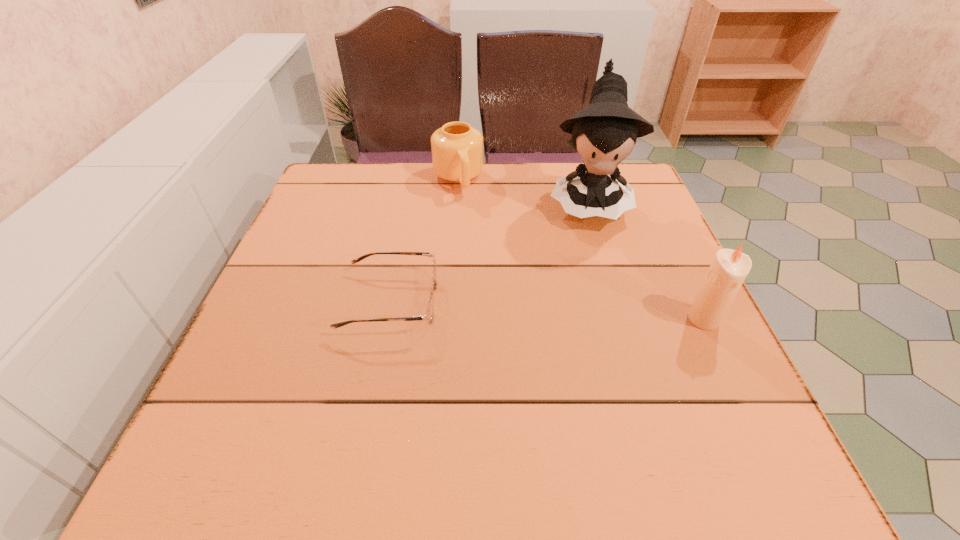
I want to click on vacant space at the near edge, so click(x=534, y=410).

This screenshot has height=540, width=960. In the image, there is a desktop. Identify the location of vacant space at the left edge. (302, 291).

This screenshot has width=960, height=540. I want to click on vacant space at the right edge of the desktop, so click(636, 319).

This screenshot has width=960, height=540. What are the coordinates of `free region at the far left corner` in the screenshot? It's located at (338, 171).

You are a GUI agent. You are given a task and a screenshot of the screen. Output one action in this format:
    pyautogui.click(x=<x>, y=<y>)
    Task: Click on the free space at the near left corner of the desktop
    This screenshot has width=960, height=540.
    Given the screenshot: What is the action you would take?
    pyautogui.click(x=213, y=421)

This screenshot has width=960, height=540. I want to click on free space at the far right corner, so click(638, 207).

In the image, there is a desktop. Identify the location of vacant area at the near right corner. (706, 393).

Find the location of a particular element. The image size is (960, 540). vacant space in between the shortest object and the mug is located at coordinates (424, 241).

Image resolution: width=960 pixels, height=540 pixels. Find the location of `free space between the third tallest object and the third shortest object`. free space between the third tallest object and the third shortest object is located at coordinates (581, 249).

I want to click on free space that is in between the spectacles and the second tallest object, so click(547, 310).